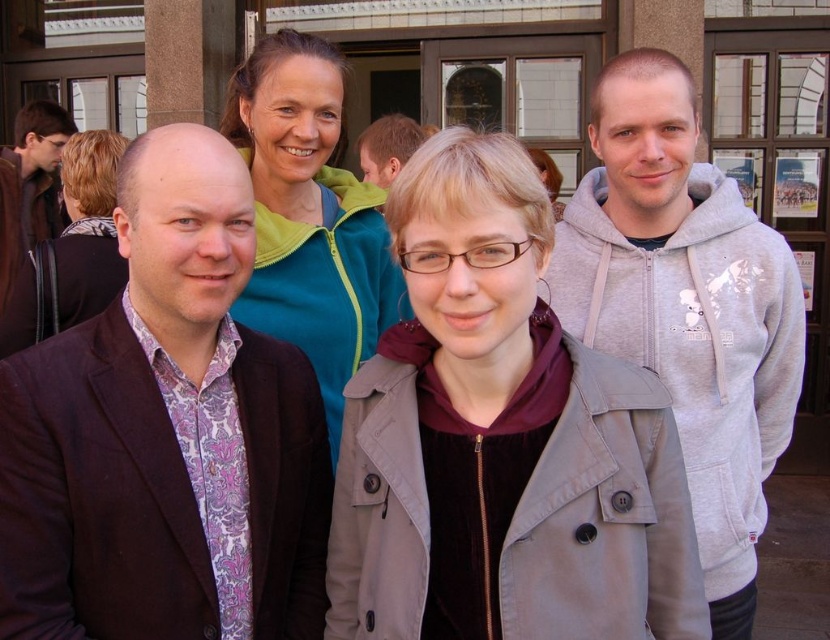
Where is `gray hoodie at right`? This screenshot has width=830, height=640. gray hoodie at right is located at coordinates (686, 307).

Who is lower down, gray hoodie at right or matte black jacket at left?

Positioned lower is gray hoodie at right.

Locate an element on the screen. This screenshot has width=830, height=640. gray hoodie at right is located at coordinates (686, 307).

Between patterned fabric shirt at center and matte black jacket at left, which one has less height?

Standing shorter between the two is matte black jacket at left.

Is point (223, 422) farther from camera compared to point (49, 198)?

No.

Between point (232, 184) and point (7, 198), which one is positioned in front?

Point (232, 184) is more forward.

This screenshot has width=830, height=640. In order to click on patterned fabric shirt at center in this screenshot , I will do `click(166, 435)`.

Does point (42, 458) come farther from viewer compared to point (725, 218)?

No, (42, 458) is closer to viewer.

Is patterned fabric shirt at center in front of gray hoodie at right?

Yes, it is.

Between point (5, 440) and point (738, 269), which one is positioned in front?

Point (5, 440) is more forward.

What are the coordinates of `patterned fabric shirt at center` in the screenshot? It's located at (166, 435).